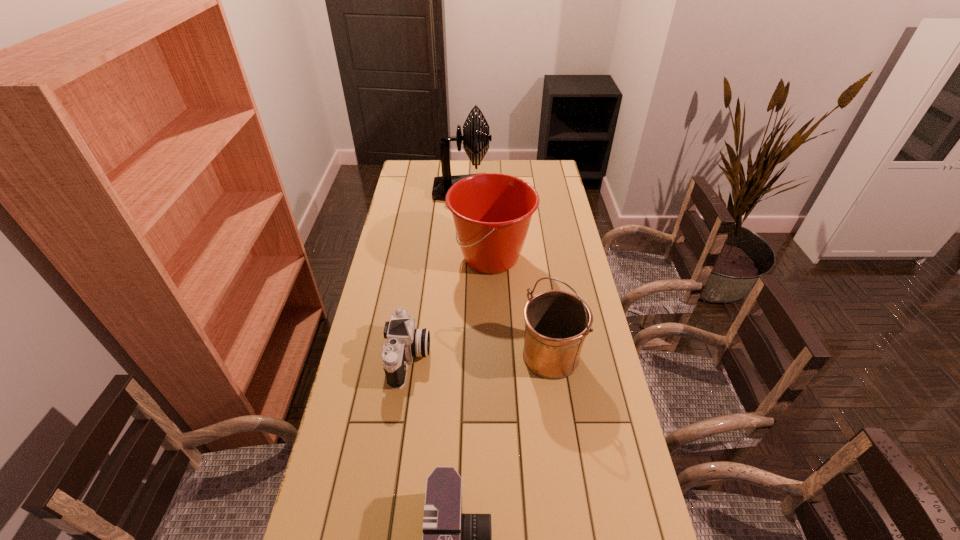
This screenshot has width=960, height=540. What are the coordinates of `fan` in the screenshot? It's located at (473, 138).

At what (x,y) coordinates should I click in order to perform the action: click on the farthest object. Please return your answer as a coordinate pair (x, y). Image resolution: width=960 pixels, height=540 pixels. Looking at the image, I should click on (473, 138).

The width and height of the screenshot is (960, 540). In order to click on the nearer bucket in this screenshot , I will do (x=557, y=322).

Identify the location of the farther bucket. This screenshot has width=960, height=540. (492, 212).

Image resolution: width=960 pixels, height=540 pixels. What are the coordinates of `the farther camera` in the screenshot? It's located at (404, 342).

Locate an element on the screen. The height and width of the screenshot is (540, 960). free region located 0.150m in front of the farthest object to blow air is located at coordinates (522, 192).

Where is `vacant space located 0.300m on the front of the nearer bucket`? vacant space located 0.300m on the front of the nearer bucket is located at coordinates (569, 485).

Where is `vacant space situated 0.150m with the handle attached to the rim of the farther bucket`? This screenshot has height=540, width=960. vacant space situated 0.150m with the handle attached to the rim of the farther bucket is located at coordinates (412, 258).

This screenshot has width=960, height=540. Find the location of `vacant space located with the handle attached to the rim of the farther bucket`. vacant space located with the handle attached to the rim of the farther bucket is located at coordinates (420, 258).

At what (x,y) coordinates should I click in order to perform the action: click on vacant region located 0.060m with the handle attached to the rim of the farther bucket. Please return your answer as a coordinate pair (x, y). Looking at the image, I should click on (434, 258).